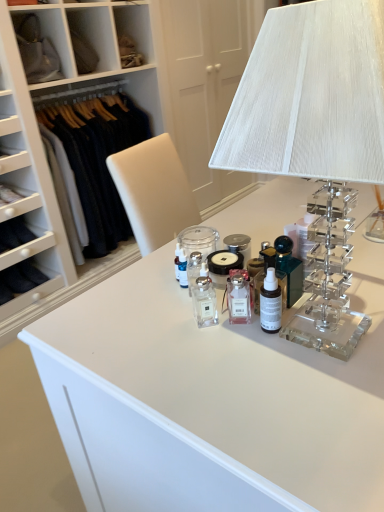
Question: Is satin black bottle at center, the first toiletry positioned from the right, to the left of clear acrylic table lamp at upper right from the viewer's perspective?

Choices:
 (A) no
 (B) yes

Answer: (B)

Question: From the image's perspective, is satin black bottle at center, the first toiletry positioned from the right, located above clear acrylic table lamp at upper right?

Choices:
 (A) no
 (B) yes

Answer: (A)

Question: Does satin black bottle at center, which is counted as the 2th toiletry, starting from the left, come behind clear acrylic table lamp at upper right?

Choices:
 (A) yes
 (B) no

Answer: (A)

Question: Can you confirm if satin black bottle at center, which is counted as the 2th toiletry, starting from the left, is positioned to the right of clear acrylic table lamp at upper right?

Choices:
 (A) yes
 (B) no

Answer: (B)

Question: Can you confirm if satin black bottle at center, which is counted as the 2th toiletry, starting from the left, is bigger than clear acrylic table lamp at upper right?

Choices:
 (A) yes
 (B) no

Answer: (B)

Question: In terms of width, does dark wool sweater at left look wider or thinner when compared to satin black bottle at center, the first toiletry positioned from the right?

Choices:
 (A) thin
 (B) wide

Answer: (B)

Question: Is point [x=135, y=126] positioned closer to the camera than point [x=273, y=330]?

Choices:
 (A) closer
 (B) farther

Answer: (B)

Question: Is dark wool sweater at left situated inside satin black bottle at center, the first toiletry positioned from the right, or outside?

Choices:
 (A) outside
 (B) inside

Answer: (A)

Question: Considering the positions of dark wool sweater at left and satin black bottle at center, the first toiletry positioned from the right, in the image, is dark wool sweater at left bigger or smaller than satin black bottle at center, the first toiletry positioned from the right,?

Choices:
 (A) big
 (B) small

Answer: (A)

Question: Considering the positions of dark wool sweater at left and clear glass bottle at center, which ranks as the 2th toiletry in right-to-left order, in the image, is dark wool sweater at left bigger or smaller than clear glass bottle at center, which ranks as the 2th toiletry in right-to-left order,?

Choices:
 (A) small
 (B) big

Answer: (B)

Question: In terms of height, does dark wool sweater at left look taller or shorter compared to clear glass bottle at center, which ranks as the 2th toiletry in right-to-left order?

Choices:
 (A) short
 (B) tall

Answer: (B)

Question: Relative to clear glass bottle at center, which ranks as the 2th toiletry in right-to-left order, is dark wool sweater at left in front or behind?

Choices:
 (A) behind
 (B) front

Answer: (A)

Question: In terms of width, does dark wool sweater at left look wider or thinner when compared to clear glass bottle at center, the 1th toiletry from the left?

Choices:
 (A) thin
 (B) wide

Answer: (B)

Question: Does point (200, 317) appear closer or farther from the camera than point (79, 125)?

Choices:
 (A) closer
 (B) farther

Answer: (A)

Question: In the image, is clear glass bottle at center, the 1th toiletry from the left, positioned in front of or behind dark wool sweater at left?

Choices:
 (A) behind
 (B) front

Answer: (B)